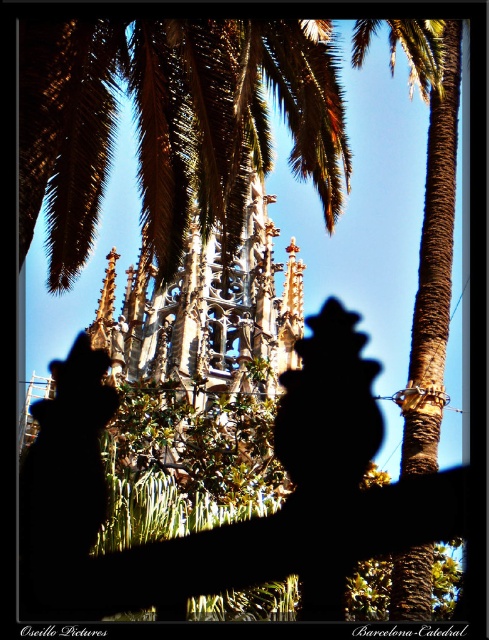
Question: Which point is farther to the camera?

Choices:
 (A) brown rough palm tree at center
 (B) green leafy palm at upper center

Answer: (A)

Question: Considering the relative positions of green leafy palm at upper center and brown rough palm tree at center in the image provided, where is green leafy palm at upper center located with respect to brown rough palm tree at center?

Choices:
 (A) below
 (B) above

Answer: (B)

Question: Does green leafy palm at upper center come in front of brown rough palm tree at center?

Choices:
 (A) yes
 (B) no

Answer: (A)

Question: From the image, what is the correct spatial relationship of green leafy palm at upper center in relation to brown rough palm tree at center?

Choices:
 (A) below
 (B) above

Answer: (B)

Question: Among these points, which one is nearest to the camera?

Choices:
 (A) (423, 424)
 (B) (288, 36)

Answer: (A)

Question: Among these objects, which one is nearest to the camera?

Choices:
 (A) green leafy palm at upper center
 (B) brown rough palm tree at center

Answer: (A)